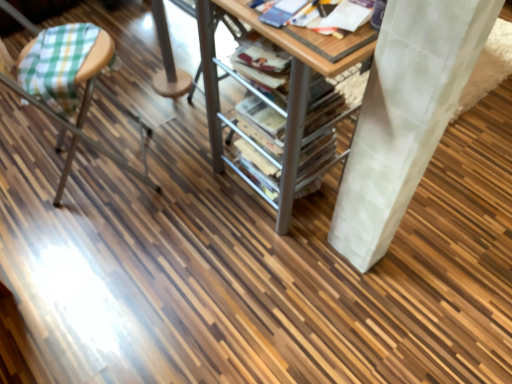
Question: Would you say wooden table at center is outside green plaid fabric stool at left?

Choices:
 (A) no
 (B) yes

Answer: (B)

Question: From a real-world perspective, is wooden table at center positioned over green plaid fabric stool at left based on gravity?

Choices:
 (A) no
 (B) yes

Answer: (A)

Question: Is wooden table at center closer to the viewer compared to green plaid fabric stool at left?

Choices:
 (A) no
 (B) yes

Answer: (B)

Question: Considering the relative sizes of wooden table at center and green plaid fabric stool at left in the image provided, is wooden table at center wider than green plaid fabric stool at left?

Choices:
 (A) yes
 (B) no

Answer: (B)

Question: Is there a large distance between wooden table at center and green plaid fabric stool at left?

Choices:
 (A) yes
 (B) no

Answer: (B)

Question: From the image's perspective, is wooden table at center over green plaid fabric stool at left?

Choices:
 (A) yes
 (B) no

Answer: (A)

Question: Is green plaid fabric stool at left looking in the opposite direction of wooden table at center?

Choices:
 (A) no
 (B) yes

Answer: (A)

Question: Is green plaid fabric stool at left touching wooden table at center?

Choices:
 (A) yes
 (B) no

Answer: (B)

Question: Is green plaid fabric stool at left not near wooden table at center?

Choices:
 (A) yes
 (B) no

Answer: (B)

Question: Could you tell me if green plaid fabric stool at left is facing wooden table at center?

Choices:
 (A) yes
 (B) no

Answer: (A)

Question: Is green plaid fabric stool at left surrounding wooden table at center?

Choices:
 (A) no
 (B) yes

Answer: (A)

Question: Considering the relative positions of green plaid fabric stool at left and wooden table at center in the image provided, is green plaid fabric stool at left to the left of wooden table at center from the viewer's perspective?

Choices:
 (A) yes
 (B) no

Answer: (A)

Question: From a real-world perspective, relative to green plaid fabric stool at left, is wooden table at center vertically above or below?

Choices:
 (A) above
 (B) below

Answer: (B)